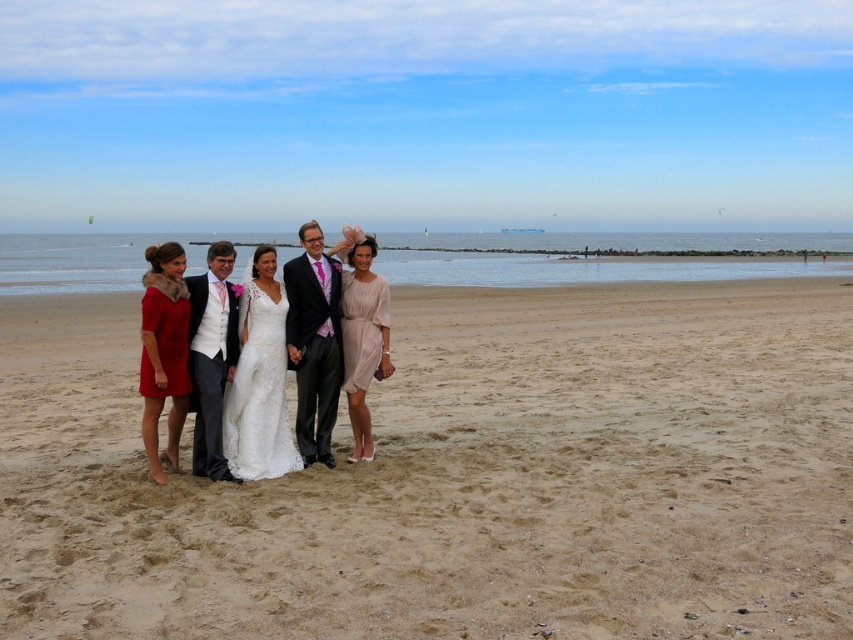
You are a photographer setting up for a beach wedding photo. You see the sandy beach at center and the matte beige dress at center. Which object is positioned higher in the image?

The sandy beach at center is located above the matte beige dress at center, so it is positioned higher in the image.

You are a photographer standing on the sandy beach at center and want to position the matte beige dress at center so that it is directly in front of you. Should you move the dress to your left or right?

The sandy beach at center is to the right of the matte beige dress at center, so to position the matte beige dress at center directly in front of you, you should move it to your left.